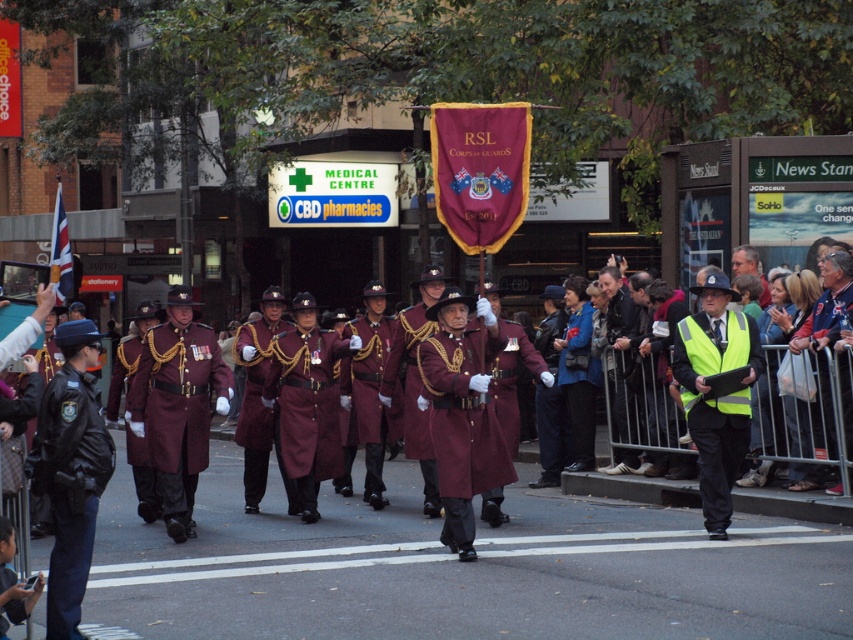
This screenshot has height=640, width=853. What do you see at coordinates (178, 406) in the screenshot?
I see `maroon woolen coat at center` at bounding box center [178, 406].

Find the location of a particular element. The width and height of the screenshot is (853, 640). maroon woolen coat at center is located at coordinates (178, 406).

The image size is (853, 640). I want to click on maroon woolen coat at center, so click(x=178, y=406).

Is point (65, 493) positioned before point (485, 332)?

That is True.

Which is above, black leather jacket at left or maroon wool coat at center?

Positioned higher is maroon wool coat at center.

Is point (82, 477) farther from camera compared to point (482, 422)?

No, (82, 477) is in front of (482, 422).

Find the location of `black leather jacket at left`. black leather jacket at left is located at coordinates (70, 486).

Who is positioned more to the left, maroon fabric uniform at center or yellow reflective vest at center?

From the viewer's perspective, maroon fabric uniform at center appears more on the left side.

Is maroon fabric uniform at center bigger than yellow reflective vest at center?

Correct, maroon fabric uniform at center is larger in size than yellow reflective vest at center.

Is point (583, 605) positioned before point (694, 362)?

Yes, point (583, 605) is in front of point (694, 362).

The height and width of the screenshot is (640, 853). Find the location of `maroon fabric uniform at center`. maroon fabric uniform at center is located at coordinates (457, 570).